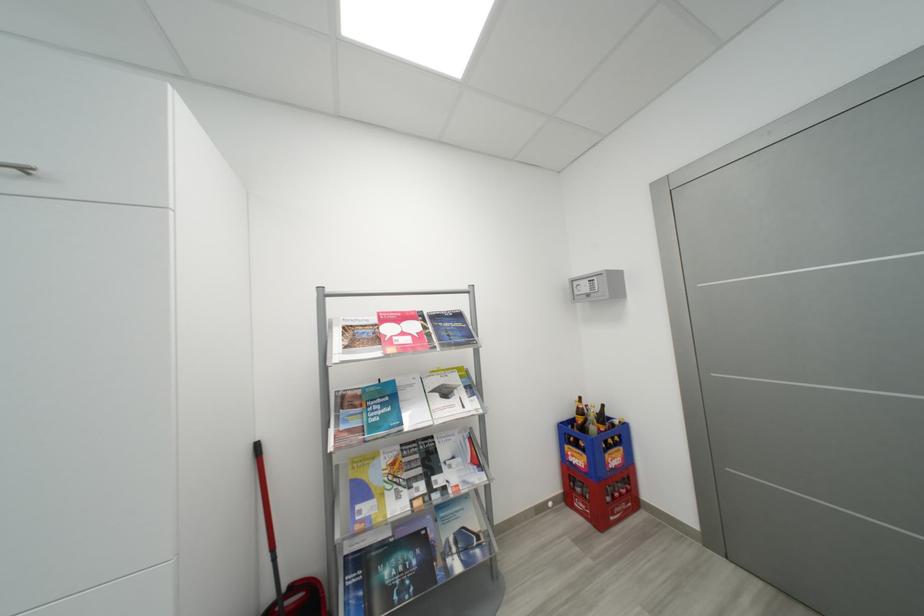
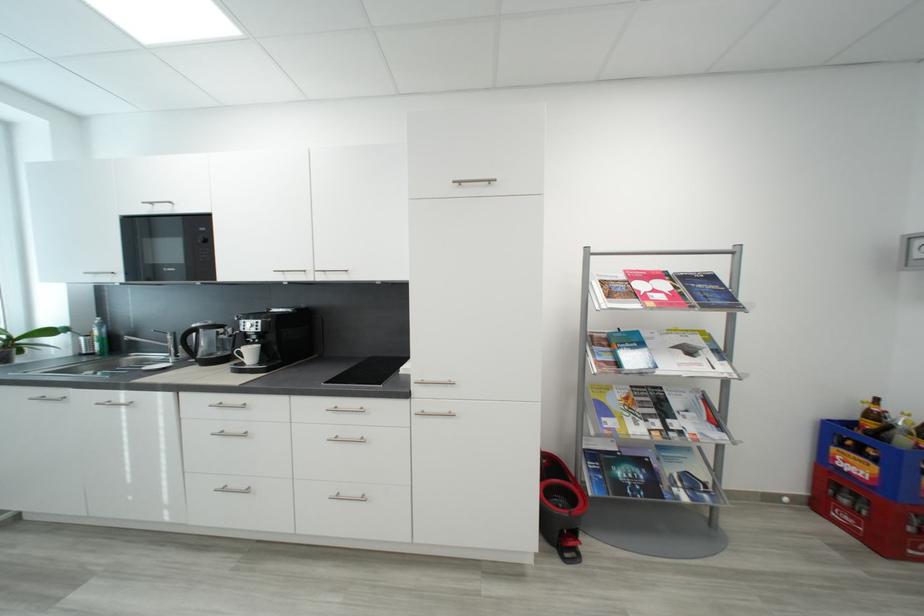
Locate, in the second image, the point that corresponds to (x=453, y=394) in the first image.

(697, 353)